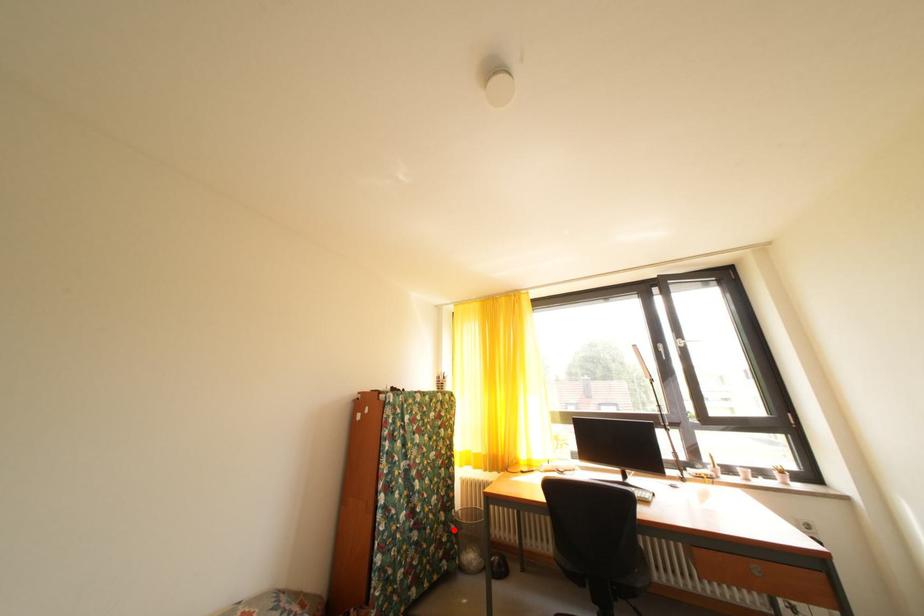
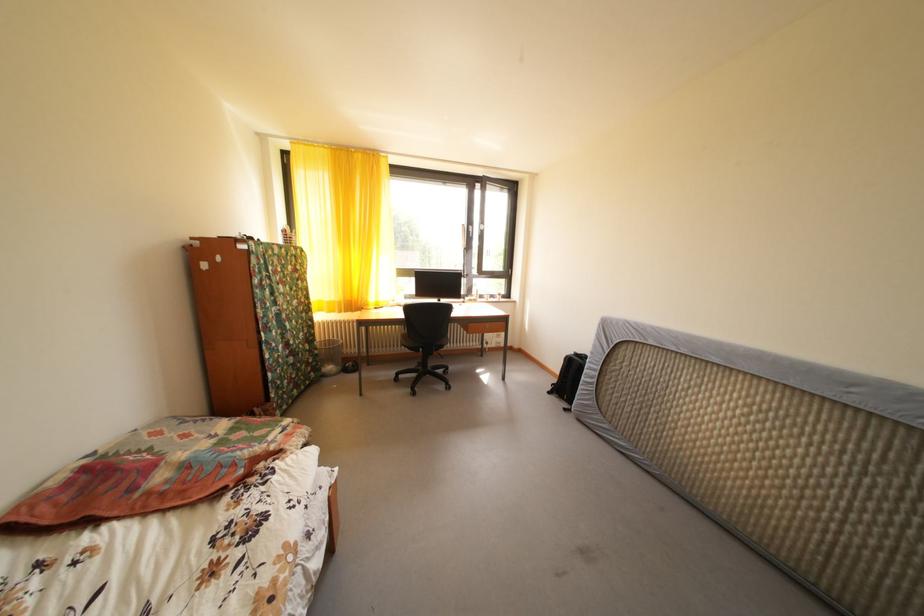
Question: A red point is marked in image1. In image2, is the corresponding 3D point closer to the camera or farther? Reply with the corresponding letter.

Choices:
 (A) The corresponding 3D point is closer.
 (B) The corresponding 3D point is farther.

Answer: (A)